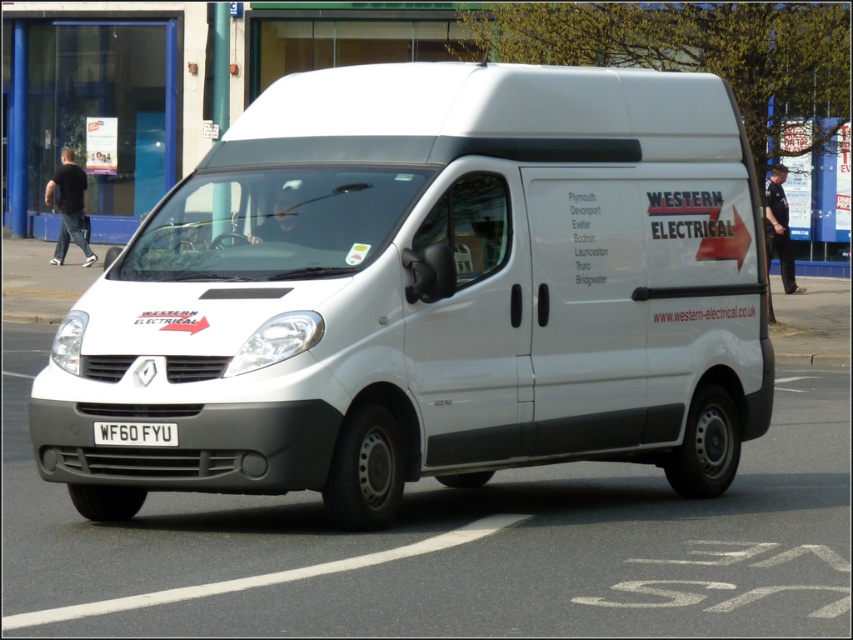
Is white matte van at center taller than white metallic license plate at center?

Indeed, white matte van at center has a greater height compared to white metallic license plate at center.

Is white matte van at center bigger than white metallic license plate at center?

Correct, white matte van at center is larger in size than white metallic license plate at center.

What do you see at coordinates (428, 292) in the screenshot?
I see `white matte van at center` at bounding box center [428, 292].

The image size is (853, 640). I want to click on white matte van at center, so click(x=428, y=292).